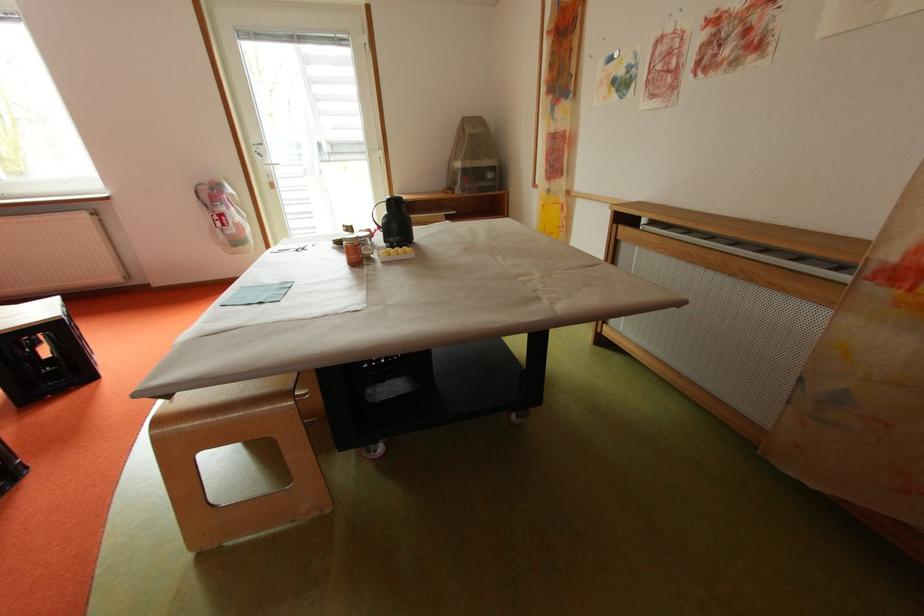
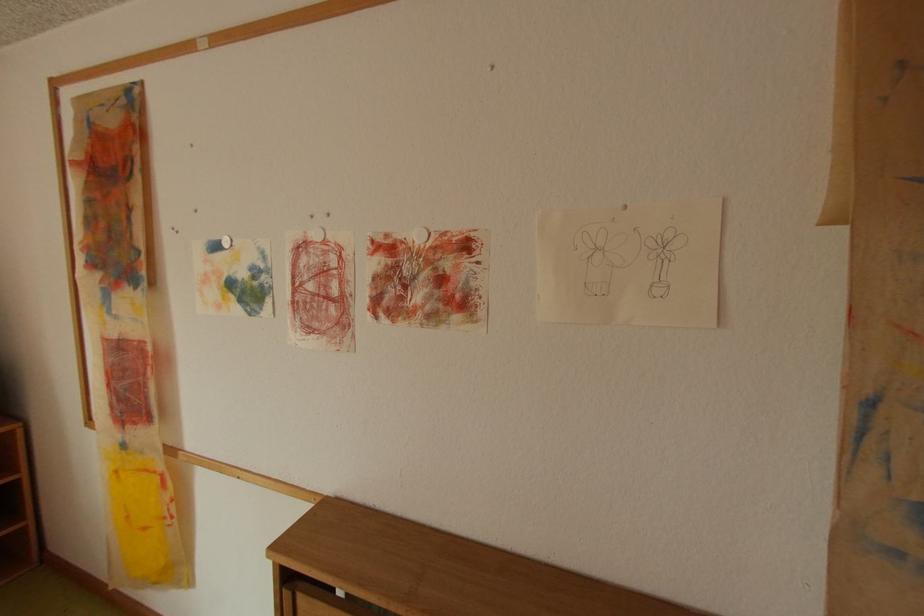
Locate, in the second image, the point that corresponds to the point at 558,191 in the first image.

(134, 446)